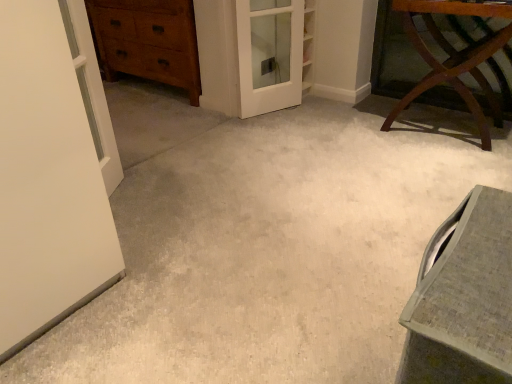
Question: Considering the relative sizes of mahogany wood table at upper right and white glossy door at upper left in the image provided, is mahogany wood table at upper right smaller than white glossy door at upper left?

Choices:
 (A) yes
 (B) no

Answer: (B)

Question: Is mahogany wood table at upper right bigger than white glossy door at upper left?

Choices:
 (A) no
 (B) yes

Answer: (B)

Question: Considering the relative positions of mahogany wood table at upper right and white glossy door at upper left in the image provided, is mahogany wood table at upper right in front of white glossy door at upper left?

Choices:
 (A) no
 (B) yes

Answer: (A)

Question: Considering the relative positions of mahogany wood table at upper right and white glossy door at upper left in the image provided, is mahogany wood table at upper right to the right of white glossy door at upper left from the viewer's perspective?

Choices:
 (A) no
 (B) yes

Answer: (B)

Question: Considering the relative sizes of mahogany wood table at upper right and white glossy door at upper left in the image provided, is mahogany wood table at upper right wider than white glossy door at upper left?

Choices:
 (A) no
 (B) yes

Answer: (B)

Question: Is mahogany wood table at upper right thinner than white glossy door at upper left?

Choices:
 (A) no
 (B) yes

Answer: (A)

Question: Is wooden chest of drawers at upper left taller than matte gray vanity at lower right?

Choices:
 (A) yes
 (B) no

Answer: (A)

Question: From the image's perspective, is wooden chest of drawers at upper left below matte gray vanity at lower right?

Choices:
 (A) yes
 (B) no

Answer: (B)

Question: Does wooden chest of drawers at upper left appear on the right side of matte gray vanity at lower right?

Choices:
 (A) yes
 (B) no

Answer: (B)

Question: Can you confirm if wooden chest of drawers at upper left is positioned to the left of matte gray vanity at lower right?

Choices:
 (A) yes
 (B) no

Answer: (A)

Question: Is wooden chest of drawers at upper left positioned behind matte gray vanity at lower right?

Choices:
 (A) yes
 (B) no

Answer: (A)

Question: From a real-world perspective, is wooden chest of drawers at upper left physically above matte gray vanity at lower right?

Choices:
 (A) yes
 (B) no

Answer: (A)

Question: Does white glossy door at upper left contain white glass screen door at center?

Choices:
 (A) no
 (B) yes

Answer: (A)